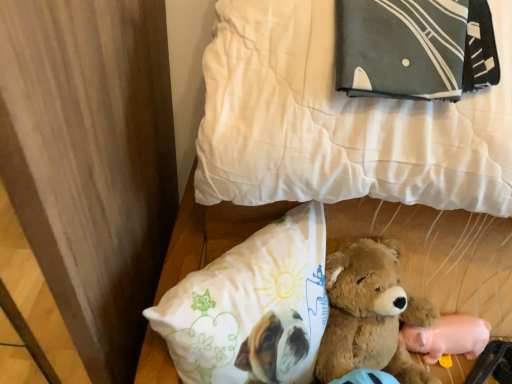
Question: Is the position of white quilted bed at upper center more distant than that of pink rubber pig at lower right?

Choices:
 (A) no
 (B) yes

Answer: (A)

Question: Is white quilted bed at upper center facing away from pink rubber pig at lower right?

Choices:
 (A) no
 (B) yes

Answer: (B)

Question: From a real-world perspective, is white quilted bed at upper center on pink rubber pig at lower right?

Choices:
 (A) yes
 (B) no

Answer: (A)

Question: Is pink rubber pig at lower right a part of white quilted bed at upper center?

Choices:
 (A) yes
 (B) no

Answer: (A)

Question: From a real-world perspective, is white quilted bed at upper center physically below pink rubber pig at lower right?

Choices:
 (A) no
 (B) yes

Answer: (A)

Question: Is white quilted bed at upper center positioned far away from pink rubber pig at lower right?

Choices:
 (A) yes
 (B) no

Answer: (B)

Question: Does pink rubber pig at lower right have a smaller size compared to white quilted bed at upper center?

Choices:
 (A) no
 (B) yes

Answer: (B)

Question: Is pink rubber pig at lower right to the right of white quilted bed at upper center from the viewer's perspective?

Choices:
 (A) yes
 (B) no

Answer: (A)

Question: Is the position of pink rubber pig at lower right more distant than that of white quilted bed at upper center?

Choices:
 (A) no
 (B) yes

Answer: (B)

Question: From a real-world perspective, is pink rubber pig at lower right located higher than white quilted bed at upper center?

Choices:
 (A) no
 (B) yes

Answer: (A)

Question: From the image's perspective, does pink rubber pig at lower right appear lower than white quilted bed at upper center?

Choices:
 (A) yes
 (B) no

Answer: (A)

Question: From the image's perspective, is pink rubber pig at lower right on top of white quilted bed at upper center?

Choices:
 (A) yes
 (B) no

Answer: (B)

Question: Is white quilted bed at upper center at the right side of white fabric pillow at lower center, arranged as the 1th pillow when ordered from the bottom?

Choices:
 (A) no
 (B) yes

Answer: (B)